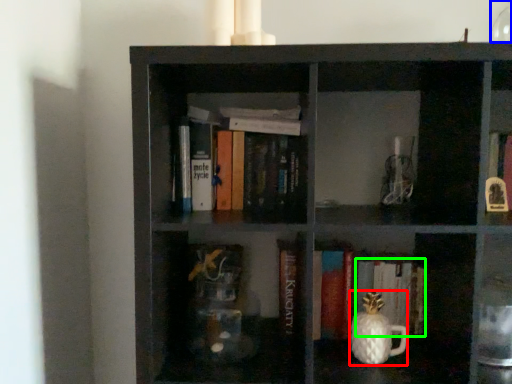
Question: Estimate the real-world distances between objects in this image. Which object is closer to tea pot (highlighted by a red box), glass vase (highlighted by a blue box) or book (highlighted by a green box)?

Choices:
 (A) glass vase
 (B) book

Answer: (B)